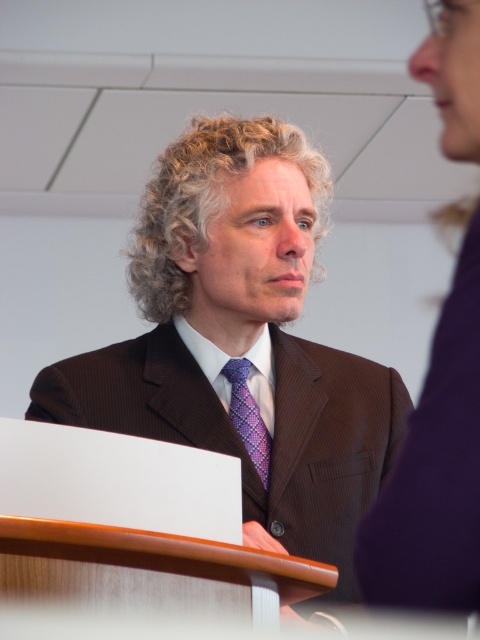
Question: Which object is closer to the camera taking this photo?

Choices:
 (A) purple woven tie at center
 (B) brown textured suit at center

Answer: (B)

Question: Which object is the farthest from the purple woven tie at center?

Choices:
 (A) brown textured suit at center
 (B) curly blonde hair at center

Answer: (B)

Question: Does brown textured suit at center have a larger size compared to curly blonde hair at center?

Choices:
 (A) yes
 (B) no

Answer: (A)

Question: Which object appears farthest from the camera in this image?

Choices:
 (A) purple woven tie at center
 (B) curly blonde hair at center

Answer: (B)

Question: Does brown textured suit at center appear on the left side of purple woven tie at center?

Choices:
 (A) yes
 (B) no

Answer: (A)

Question: From the image, what is the correct spatial relationship of brown textured suit at center in relation to purple woven tie at center?

Choices:
 (A) right
 (B) left

Answer: (B)